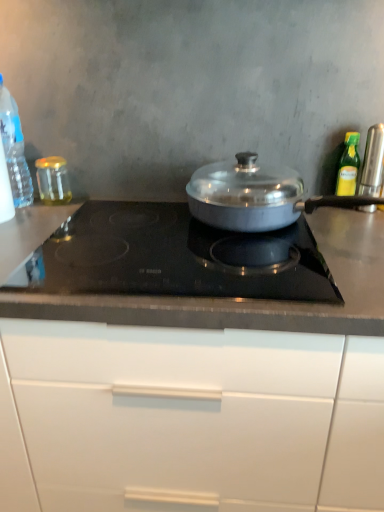
The image size is (384, 512). Identify the location of vacant area that is in front of satin silver canister at right, which is the fifth kitchen appliance from left to right. (360, 230).